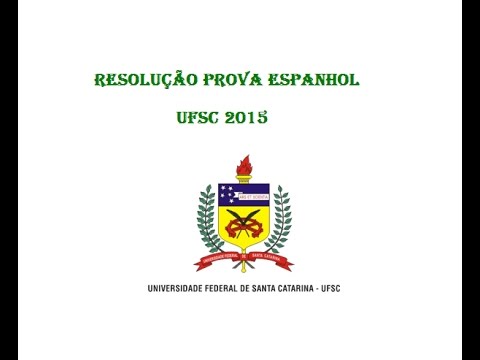
This screenshot has width=480, height=360. Identify the location of wreath/plant around logo. (198, 218).